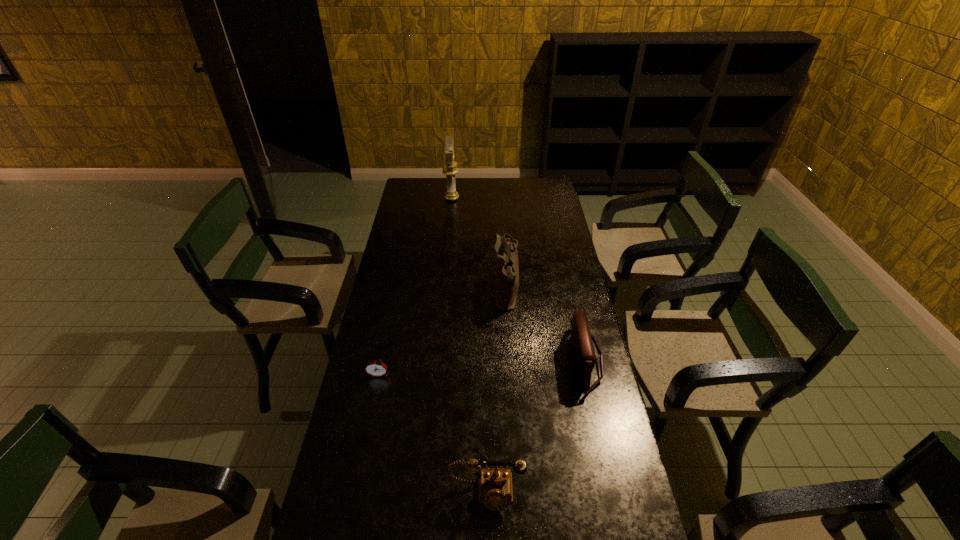
Where is `free location located on the front-facing side of the farther shoulder bag`? This screenshot has height=540, width=960. free location located on the front-facing side of the farther shoulder bag is located at coordinates (444, 295).

Where is `free space located 0.080m on the front-facing side of the farther shoulder bag`? Image resolution: width=960 pixels, height=540 pixels. free space located 0.080m on the front-facing side of the farther shoulder bag is located at coordinates (472, 295).

You are a GUI agent. You are given a task and a screenshot of the screen. Output one action in this format:
    pyautogui.click(x=<x>, y=<y>)
    Task: Click on the vacant space situated on the front-facing side of the farther shoulder bag
    Image resolution: width=960 pixels, height=540 pixels.
    Given the screenshot: What is the action you would take?
    pyautogui.click(x=475, y=295)

You are a GUI agent. You are given a task and a screenshot of the screen. Output one action in this format:
    pyautogui.click(x=<x>, y=<y>)
    Task: Click on the vacant region located on the dial number of the nearest object
    
    Given the screenshot: What is the action you would take?
    pyautogui.click(x=487, y=533)

In order to click on free location located 0.100m on the front flap of the nearer shoulder bag in this screenshot , I will do `click(542, 361)`.

Identify the location of free space located 0.290m on the front flap of the nearer shoulder bag. This screenshot has height=540, width=960. (489, 361).

At what (x,y) coordinates should I click in order to perform the action: click on vacant space located 0.290m on the front flap of the nearer shoulder bag. Please return your answer as a coordinate pair (x, y). Looking at the image, I should click on (489, 361).

Find the location of a particular element. free space located 0.400m on the clock face of the alarm clock is located at coordinates (351, 501).

Image resolution: width=960 pixels, height=540 pixels. What are the coordinates of `object located in the far edge section of the desktop` in the screenshot? It's located at (450, 169).

Locate an element on the screen. This screenshot has width=960, height=540. object that is at the left edge is located at coordinates (377, 368).